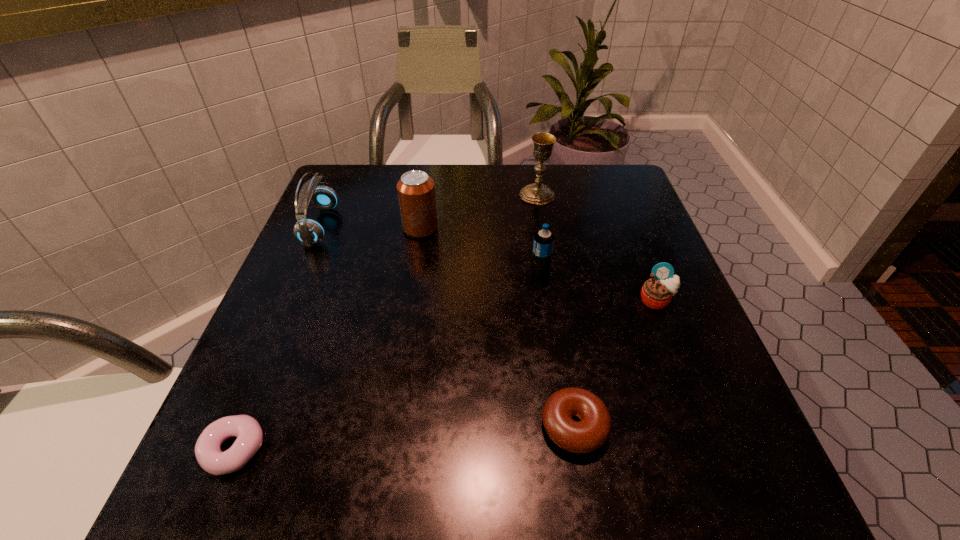
Where is `chalice`? This screenshot has width=960, height=540. chalice is located at coordinates (537, 193).

At what (x,y) coordinates should I click in order to perform the action: click on can. Please return your answer as a coordinate pair (x, y). The height and width of the screenshot is (540, 960). Looking at the image, I should click on (x=416, y=191).

Where is `headset`? headset is located at coordinates (308, 231).

Locate an element on the screen. This screenshot has height=540, width=960. soda bottle is located at coordinates (543, 241).

Locate an element on the screen. The width and height of the screenshot is (960, 540). the rightmost object is located at coordinates (656, 293).

Locate an element on the screen. The image size is (960, 540). the fifth farthest object is located at coordinates pyautogui.click(x=656, y=293).

This screenshot has height=540, width=960. What are the coordinates of `the right doughnut` in the screenshot? It's located at (590, 433).

You are a GUI agent. You are given a task and a screenshot of the screen. Output one action in this format:
    pyautogui.click(x=<x>, y=<y>)
    Task: Click on the sixth tallest object
    
    Given the screenshot: What is the action you would take?
    pyautogui.click(x=590, y=433)

The width and height of the screenshot is (960, 540). I want to click on the shorter doughnut, so click(x=211, y=458).

Find the location of a particular element. This screenshot has width=960, height=540. the left doughnut is located at coordinates (211, 458).